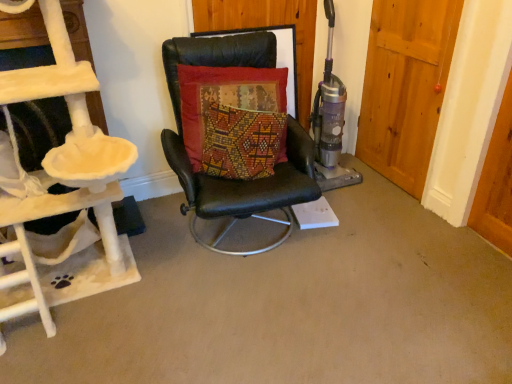
What do you see at coordinates (405, 86) in the screenshot?
I see `wooden door at right` at bounding box center [405, 86].

The image size is (512, 384). I want to click on wooden door at right, so click(x=405, y=86).

Measure the distance from velvet cushion at center to beige plush cat tree at left.

A distance of 24.41 inches exists between velvet cushion at center and beige plush cat tree at left.

Would you say velvet cushion at center is outside beige plush cat tree at left?

Yes.

Is velvet cushion at center bigger or smaller than beige plush cat tree at left?

Considering their sizes, velvet cushion at center takes up less space than beige plush cat tree at left.

Image resolution: width=512 pixels, height=384 pixels. I want to click on pillow that appears behind the beige plush cat tree at left, so click(x=234, y=119).

Is wooden door at right oriented away from velvet cushion at center?

No, wooden door at right is not facing the opposite direction of velvet cushion at center.

Would you say wooden door at right is a long distance from velvet cushion at center?

wooden door at right is near velvet cushion at center, not far away.

Considering the relative sizes of wooden door at right and velvet cushion at center in the image provided, is wooden door at right taller than velvet cushion at center?

Yes.

Based on the photo, considering the sizes of objects black leather chair at center and wooden door at right in the image provided, who is taller, black leather chair at center or wooden door at right?

wooden door at right.

Can you confirm if black leather chair at center is positioned to the left of wooden door at right?

Correct, you'll find black leather chair at center to the left of wooden door at right.

Looking at this image, would you say wooden door at right is part of black leather chair at center's contents?

No, wooden door at right is located outside of black leather chair at center.

Is black leather chair at center oriented away from wooden door at right?

No, black leather chair at center is not facing away from wooden door at right.

Is black leather chair at center closer to the viewer compared to velvet cushion at center?

That is True.

Is velvet cushion at center at the back of black leather chair at center?

That's right, black leather chair at center is facing away from velvet cushion at center.

From the picture: Who is smaller, black leather chair at center or velvet cushion at center?

velvet cushion at center is smaller.

How many degrees apart are the facing directions of black leather chair at center and velvet cushion at center?

The angle between the facing direction of black leather chair at center and the facing direction of velvet cushion at center is 0.0809 degrees.

Considering the positions of points (98, 263) and (376, 21), is point (98, 263) farther from camera compared to point (376, 21)?

No, (98, 263) is in front of (376, 21).

In the image, there is a beige plush cat tree at left. Identify the location of door above it (from the image's perspective). The image size is (512, 384). (405, 86).

Is beige plush cat tree at left further to camera compared to wooden door at right?

That is False.

What's the angular difference between beige plush cat tree at left and wooden door at right's facing directions?

91.9 degrees separate the facing orientations of beige plush cat tree at left and wooden door at right.

Considering the relative sizes of velvet cushion at center and black leather chair at center in the image provided, is velvet cushion at center wider than black leather chair at center?

In fact, velvet cushion at center might be narrower than black leather chair at center.

From the image's perspective, is velvet cushion at center positioned above or below black leather chair at center?

velvet cushion at center is above black leather chair at center.

Considering the positions of point (281, 114) and point (220, 193), is point (281, 114) closer or farther from the camera than point (220, 193)?

Point (281, 114).

Is velvet cushion at center aimed at black leather chair at center?

Yes, velvet cushion at center is turned towards black leather chair at center.

Between wooden door at right and beige plush cat tree at left, which one has less height?

wooden door at right is shorter.

How many degrees apart are the facing directions of wooden door at right and beige plush cat tree at left?

The angle between the facing direction of wooden door at right and the facing direction of beige plush cat tree at left is 91.9 degrees.

Who is smaller, wooden door at right or beige plush cat tree at left?

wooden door at right.

Is wooden door at right in contact with beige plush cat tree at left?

wooden door at right and beige plush cat tree at left are not in contact.

Locate an element on the screen. The width and height of the screenshot is (512, 384). pillow on the right side of beige plush cat tree at left is located at coordinates [234, 119].

Find the location of a particular element. The image size is (512, 384). pillow on the left side of wooden door at right is located at coordinates (234, 119).

Which object lies nearer to the anchor point velvet cushion at center, beige plush cat tree at left or black leather chair at center?

Based on the image, black leather chair at center appears to be nearer to velvet cushion at center.

From the image, which object appears to be nearer to wooden door at right, beige plush cat tree at left or velvet cushion at center?

velvet cushion at center is closer to wooden door at right.

Consider the image. Based on their spatial positions, is velvet cushion at center or black leather chair at center closer to wooden door at right?

black leather chair at center lies closer to wooden door at right than the other object.

Which object lies further to the anchor point beige plush cat tree at left, velvet cushion at center or wooden door at right?

The object further to beige plush cat tree at left is wooden door at right.

Considering their positions, is black leather chair at center positioned closer to wooden door at right than velvet cushion at center?

black leather chair at center is closer to wooden door at right.

From the image, which object appears to be nearer to wooden door at right, beige plush cat tree at left or black leather chair at center?

Based on the image, black leather chair at center appears to be nearer to wooden door at right.

Estimate the real-world distances between objects in this image. Which object is further from wooden door at right, velvet cushion at center or beige plush cat tree at left?

beige plush cat tree at left lies further to wooden door at right than the other object.

Consider the image. Estimate the real-world distances between objects in this image. Which object is closer to black leather chair at center, velvet cushion at center or beige plush cat tree at left?

velvet cushion at center lies closer to black leather chair at center than the other object.

Locate an element on the screen. This screenshot has height=384, width=512. chair between beige plush cat tree at left and wooden door at right from left to right is located at coordinates (233, 180).

I want to click on pillow located between beige plush cat tree at left and wooden door at right in the left-right direction, so click(x=234, y=119).

Locate an element on the screen. chair between beige plush cat tree at left and velvet cushion at center in the front-back direction is located at coordinates (233, 180).

Identify the location of chair between velvet cushion at center and wooden door at right in the horizontal direction. Image resolution: width=512 pixels, height=384 pixels. (233, 180).